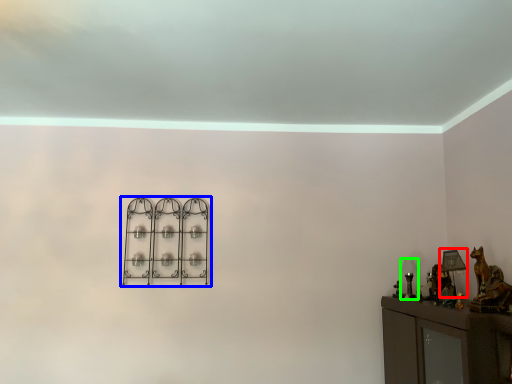
Question: Considering the real-world distances, which object is closest to table lamp (highlighted by a red box)? shelf (highlighted by a blue box) or table lamp (highlighted by a green box).

Choices:
 (A) shelf
 (B) table lamp

Answer: (B)